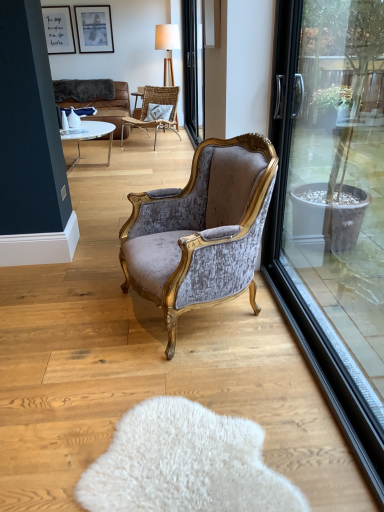
Question: From a real-world perspective, is wooden textured lamp at upper center physically below velvet/goldenchair at center, which is the first chair in bottom-to-top order?

Choices:
 (A) yes
 (B) no

Answer: (B)

Question: From the image's perspective, is wooden textured lamp at upper center beneath velvet/goldenchair at center, which is the first chair in bottom-to-top order?

Choices:
 (A) yes
 (B) no

Answer: (B)

Question: Is wooden textured lamp at upper center looking in the opposite direction of velvet/goldenchair at center, the second chair from the back?

Choices:
 (A) no
 (B) yes

Answer: (A)

Question: Does wooden textured lamp at upper center appear on the left side of velvet/goldenchair at center, which is the first chair in bottom-to-top order?

Choices:
 (A) yes
 (B) no

Answer: (A)

Question: Can you confirm if wooden textured lamp at upper center is shorter than velvet/goldenchair at center, the second chair in the top-to-bottom sequence?

Choices:
 (A) yes
 (B) no

Answer: (B)

Question: Based on their positions, is white fluffy rug at lower center located to the left or right of matte black picture frame at upper center, the 1th picture frame in the right-to-left sequence?

Choices:
 (A) right
 (B) left

Answer: (A)

Question: From a real-world perspective, is white fluffy rug at lower center above or below matte black picture frame at upper center, the 2th picture frame in the left-to-right sequence?

Choices:
 (A) above
 (B) below

Answer: (B)

Question: Is white fluffy rug at lower center taller or shorter than matte black picture frame at upper center, the 1th picture frame in the right-to-left sequence?

Choices:
 (A) tall
 (B) short

Answer: (B)

Question: Relative to matte black picture frame at upper center, the 1th picture frame in the right-to-left sequence, is white fluffy rug at lower center in front or behind?

Choices:
 (A) front
 (B) behind

Answer: (A)

Question: Considering the positions of textured gray pillow at center and white fluffy rug at lower center in the image, is textured gray pillow at center taller or shorter than white fluffy rug at lower center?

Choices:
 (A) short
 (B) tall

Answer: (B)

Question: In terms of size, does textured gray pillow at center appear bigger or smaller than white fluffy rug at lower center?

Choices:
 (A) small
 (B) big

Answer: (B)

Question: Is textured gray pillow at center inside or outside of white fluffy rug at lower center?

Choices:
 (A) inside
 (B) outside

Answer: (B)

Question: In terms of width, does textured gray pillow at center look wider or thinner when compared to white fluffy rug at lower center?

Choices:
 (A) thin
 (B) wide

Answer: (A)

Question: From the image's perspective, is matte black picture frame at upper center, the 1th picture frame in the right-to-left sequence, above or below white glossy vase at upper left, the 1th vase in the front-to-back sequence?

Choices:
 (A) above
 (B) below

Answer: (A)

Question: Is matte black picture frame at upper center, the 1th picture frame in the right-to-left sequence, in front of or behind white glossy vase at upper left, the 1th vase in the front-to-back sequence, in the image?

Choices:
 (A) front
 (B) behind

Answer: (B)